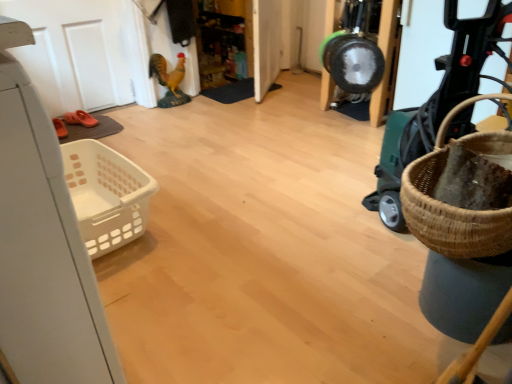
Question: From a real-world perspective, is white matte door at upper left, which ranks as the 1th door in left-to-right order, above or below white glossy door at center, which ranks as the 1th door in right-to-left order?

Choices:
 (A) below
 (B) above

Answer: (B)

Question: Would you say white matte door at upper left, which ranks as the 1th door in left-to-right order, is inside or outside white glossy door at center, the second door when ordered from left to right?

Choices:
 (A) outside
 (B) inside

Answer: (A)

Question: Based on their relative distances, which object is nearer to the shiny plastic rooster at upper center?

Choices:
 (A) white matte door at upper left, acting as the 2th door starting from the right
 (B) orange rubber sandal at left
 (C) white glossy door at center, which ranks as the 1th door in right-to-left order
 (D) green plastic baby carriage at right

Answer: (A)

Question: Based on their relative distances, which object is farther from the orange rubber sandal at left?

Choices:
 (A) white glossy door at center, the second door when ordered from left to right
 (B) green plastic baby carriage at right
 (C) white matte door at upper left, which ranks as the 1th door in left-to-right order
 (D) shiny plastic rooster at upper center

Answer: (B)